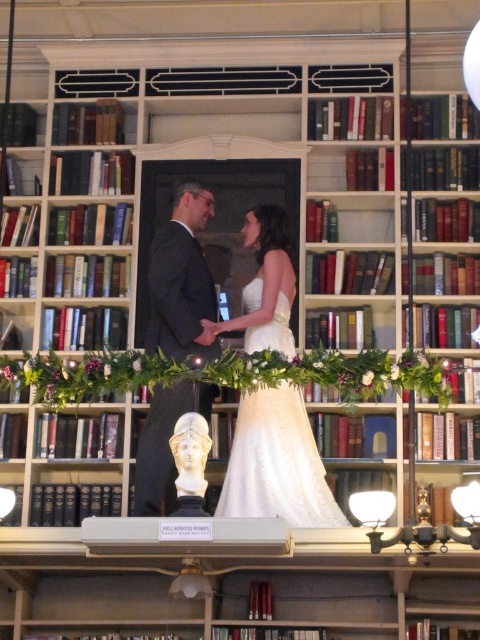
Question: Does white satin dress at center have a lesser width compared to matte black suit at center?

Choices:
 (A) no
 (B) yes

Answer: (A)

Question: Which of the following is the farthest from the observer?

Choices:
 (A) matte black suit at center
 (B) white satin dress at center

Answer: (A)

Question: Is white satin dress at center to the left of matte black suit at center from the viewer's perspective?

Choices:
 (A) yes
 (B) no

Answer: (B)

Question: Can you confirm if white satin dress at center is smaller than matte black suit at center?

Choices:
 (A) no
 (B) yes

Answer: (A)

Question: Which of the following is the farthest from the observer?

Choices:
 (A) (240, 460)
 (B) (168, 349)

Answer: (B)